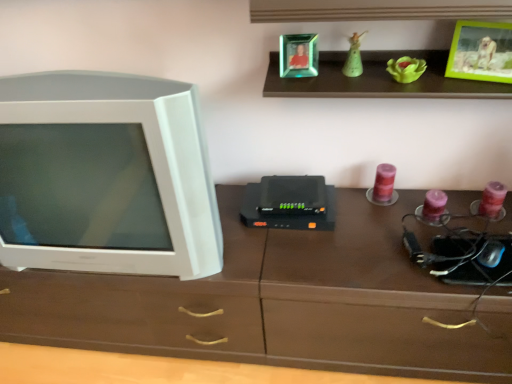
Question: Do you think purple wax candle at center-right is within emerald glass photo frame at upper center, the 2th picture frame from the right, or outside of it?

Choices:
 (A) outside
 (B) inside

Answer: (A)

Question: From a real-world perspective, relative to emerald glass photo frame at upper center, the 2th picture frame from the right, is purple wax candle at center-right vertically above or below?

Choices:
 (A) above
 (B) below

Answer: (B)

Question: Which object is the farthest from the emerald glass photo frame at upper center, the 2th picture frame from the right?

Choices:
 (A) white plastic television at left
 (B) green matte figurine at upper center
 (C) green plastic picture frame at upper right, which is the 1th picture frame in right-to-left order
 (D) purple wax candle at center-right

Answer: (A)

Question: Considering the real-world distances, which object is farthest from the emerald glass photo frame at upper center, the 2th picture frame from the right?

Choices:
 (A) green matte figurine at upper center
 (B) white plastic television at left
 (C) purple wax candle at center-right
 (D) green plastic picture frame at upper right, which is the 1th picture frame in right-to-left order

Answer: (B)